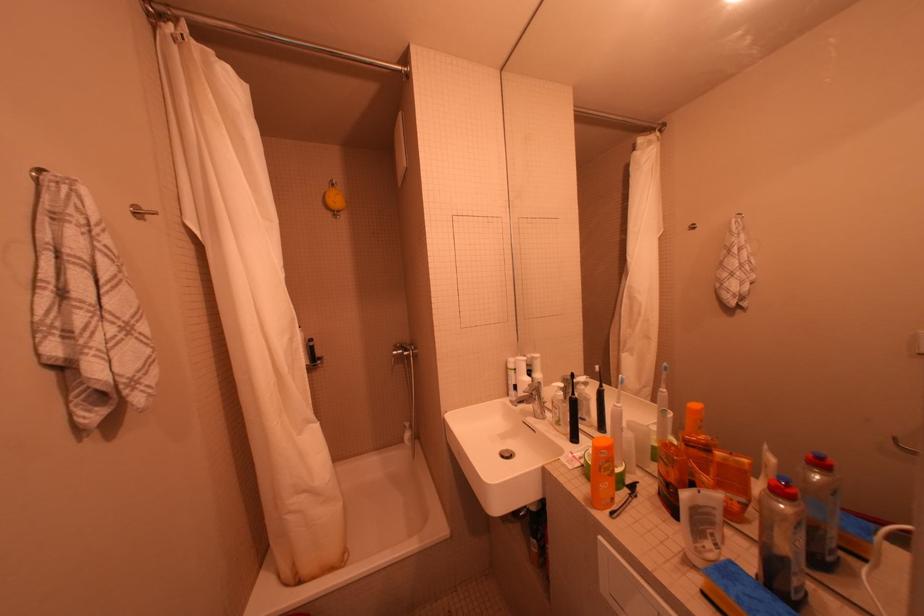
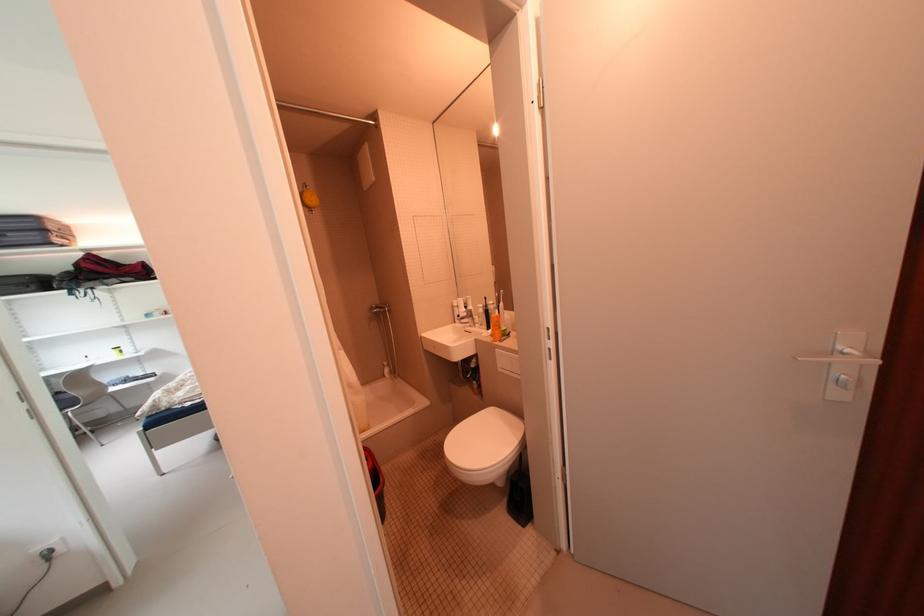
Locate, in the second image, the point that corresponds to (614,464) in the first image.

(505, 323)